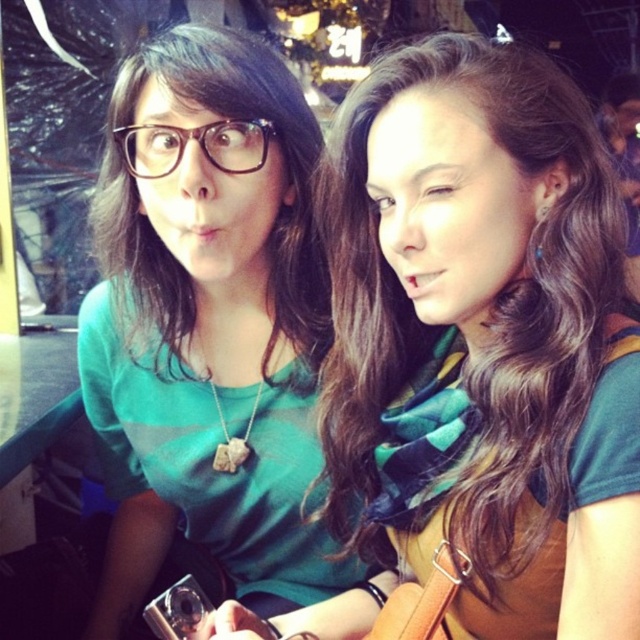
You are a photographer trying to capture a candid shot of two people sitting at a table. You want to ensure that both subjects are in focus. Given their positions at coordinates point (461, 509) and point (243, 148), which point should you focus on to ensure both are sharp?

Since point (461, 509) is in front of point (243, 148), focusing on point (461, 509) will ensure both subjects are in focus as it is closer to the camera.

You are standing in a room and see a point at coordinates (212, 333). What object is located at that point?

The point at coordinates (212, 333) corresponds to the green matte shirt at left.